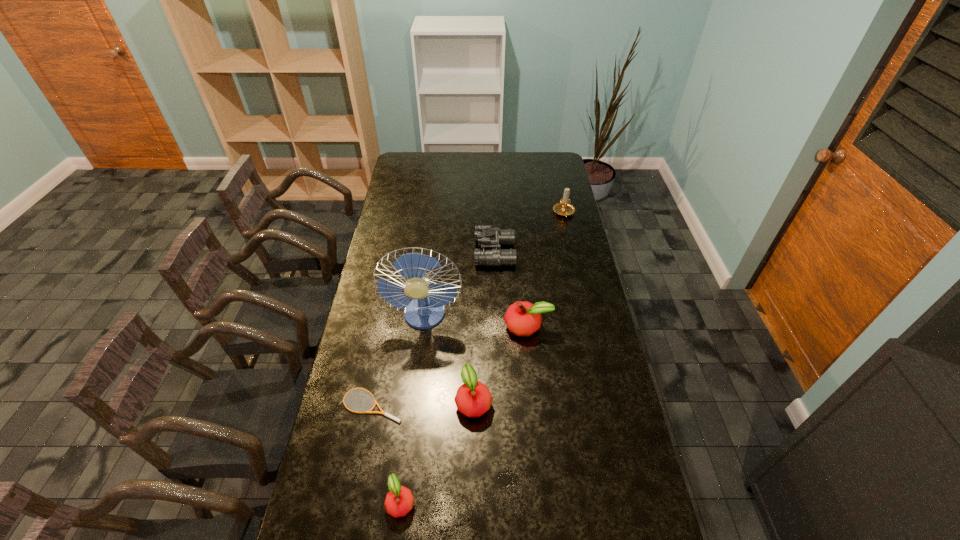
You are a GUI agent. You are given a task and a screenshot of the screen. Output one action in this format:
    pyautogui.click(x=<x>, y=<y>)
    Task: Click on the free space that is in between the farthest apple and the second farthest apple
    The height and width of the screenshot is (540, 960).
    Given the screenshot: What is the action you would take?
    pyautogui.click(x=500, y=363)

The image size is (960, 540). Find the location of `vacant space in between the tennis racket and the nearest object`. vacant space in between the tennis racket and the nearest object is located at coordinates (387, 453).

Locate an element on the screen. The height and width of the screenshot is (540, 960). empty location between the candle and the shortest object is located at coordinates click(x=468, y=309).

The image size is (960, 540). I want to click on vacant point located between the sixth nearest object and the farthest apple, so click(511, 290).

This screenshot has width=960, height=540. In order to click on free area in between the farthest apple and the shortest object in this screenshot , I will do `click(449, 365)`.

The height and width of the screenshot is (540, 960). I want to click on empty space that is in between the shortest apple and the shortest object, so click(387, 453).

What are the coordinates of `object that stands as the third closest to the fan` in the screenshot? It's located at (473, 399).

Identify the location of the fifth closest object to the farthest apple. (399, 500).

The image size is (960, 540). Find the location of `the second closest apple to the nearest apple`. the second closest apple to the nearest apple is located at coordinates (522, 318).

Where is `the closest apple to the candle`? The height and width of the screenshot is (540, 960). the closest apple to the candle is located at coordinates (522, 318).